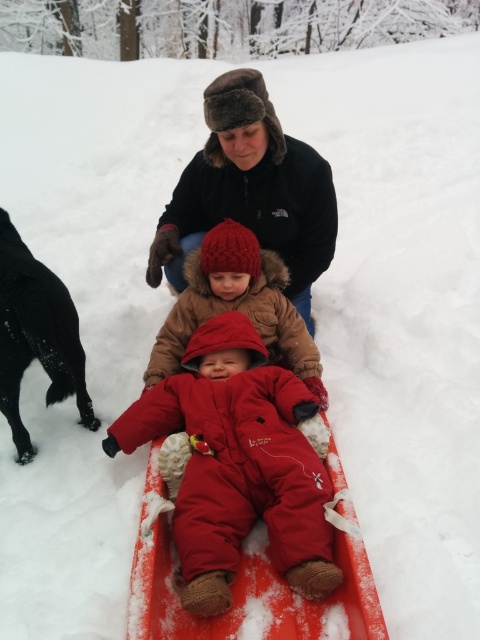
You are a photographer trying to capture a photo of the two children on the sled. You want to ensure both the matte red snowsuit at center and the red fuzzy hat at center are visible in the frame. Based on their positions, which child is positioned further to the left?

The matte red snowsuit at center is to the left of red fuzzy hat at center, so the child wearing the matte red snowsuit at center is positioned further to the left.